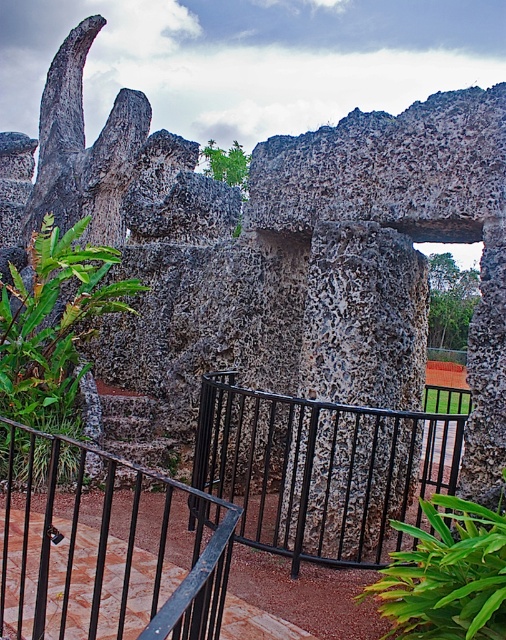
Can you confirm if green leafy plant at left is positioned to the right of rough stone stairs at center?

In fact, green leafy plant at left is to the left of rough stone stairs at center.

Does green leafy plant at left have a greater height compared to rough stone stairs at center?

Yes, green leafy plant at left is taller than rough stone stairs at center.

Describe the element at coordinates (54, 324) in the screenshot. This screenshot has height=640, width=506. I see `green leafy plant at left` at that location.

The height and width of the screenshot is (640, 506). Find the location of `green leafy plant at left`. green leafy plant at left is located at coordinates (54, 324).

Between black metal/rail at center and green leafy plant at lower right, which one is positioned lower?

Positioned lower is black metal/rail at center.

Who is higher up, black metal/rail at center or green leafy plant at lower right?

green leafy plant at lower right is higher up.

Is point (106, 492) farther from camera compared to point (414, 534)?

No, (106, 492) is in front of (414, 534).

Identify the location of black metal/rail at center. Image resolution: width=506 pixels, height=640 pixels. (106, 545).

Who is shorter, black metal balustrade at center or green leafy plant at lower right?

With less height is green leafy plant at lower right.

Is black metal balustrade at center smaller than green leafy plant at lower right?

Incorrect, black metal balustrade at center is not smaller in size than green leafy plant at lower right.

Which is in front, point (243, 461) or point (478, 584)?

Point (478, 584) is in front.

At what (x,y) coordinates should I click in order to perform the action: click on black metal balustrade at center. Please return your answer as a coordinate pair (x, y). The width and height of the screenshot is (506, 640). Looking at the image, I should click on [324, 468].